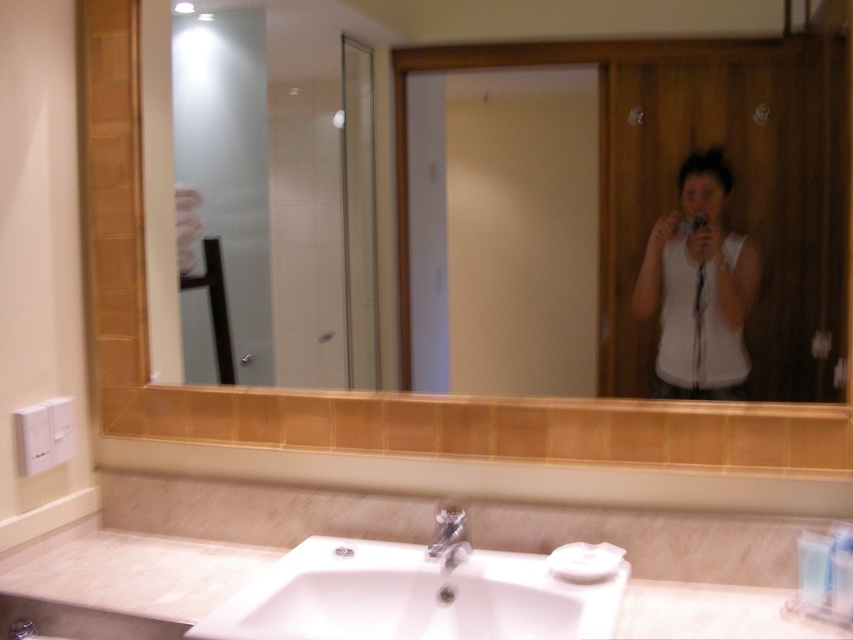
Can you confirm if wooden frame mirror at upper center is taller than satin nickel faucet at sink center?

Yes.

Can you confirm if wooden frame mirror at upper center is positioned to the right of satin nickel faucet at sink center?

In fact, wooden frame mirror at upper center is to the left of satin nickel faucet at sink center.

The image size is (853, 640). I want to click on wooden frame mirror at upper center, so click(x=463, y=42).

Image resolution: width=853 pixels, height=640 pixels. Find the location of `wooden frame mirror at upper center`. wooden frame mirror at upper center is located at coordinates (463, 42).

Between wooden frame mirror at upper center and white matte tank top at center, which one is positioned lower?

white matte tank top at center is lower down.

Is wooden frame mirror at upper center above white matte tank top at center?

Correct, wooden frame mirror at upper center is located above white matte tank top at center.

This screenshot has height=640, width=853. In order to click on wooden frame mirror at upper center in this screenshot , I will do `click(463, 42)`.

How much distance is there between white glossy sink at lower center and white matte tank top at center?

white glossy sink at lower center is 23.33 inches from white matte tank top at center.

Locate an element on the screen. Image resolution: width=853 pixels, height=640 pixels. white glossy sink at lower center is located at coordinates (412, 596).